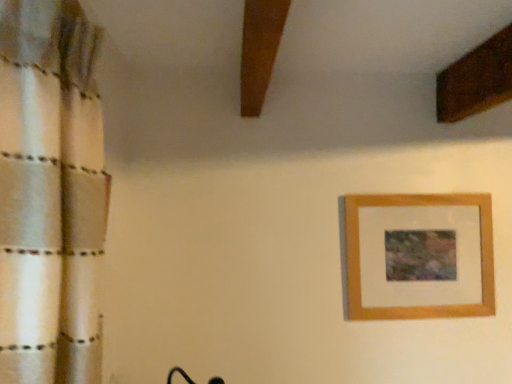
Question: Should I look upward or downward to see wooden picture frame at upper right?

Choices:
 (A) up
 (B) down

Answer: (B)